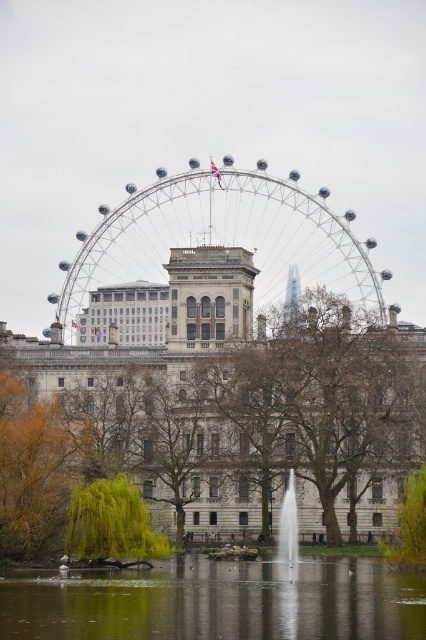
You are a GUI agent. You are given a task and a screenshot of the screen. Output one action in this format:
    pyautogui.click(x=<x>, y=<y>)
    Task: Click on the golden leafy tree at lower left
    
    Given the screenshot: What is the action you would take?
    pyautogui.click(x=34, y=468)

Between point (2, 500) and point (394, 552), which one is positioned in front?

Positioned in front is point (2, 500).

This screenshot has width=426, height=640. Identify the location of golden leafy tree at lower left. (34, 468).

Who is positioned more to the left, green reflective water at lower center or green leafy tree at lower left?

green leafy tree at lower left is more to the left.

Is green reflective water at lower center taller than green leafy tree at lower left?

In fact, green reflective water at lower center may be shorter than green leafy tree at lower left.

The image size is (426, 640). What are the coordinates of `green reflective water at lower center` in the screenshot? It's located at (218, 602).

Identify the location of green reflective water at lower center. [x=218, y=602].

Which of these two, white stone building at center or metallic ferris wheel at center, stands shorter?

Standing shorter between the two is metallic ferris wheel at center.

Can you confirm if white stone building at center is bigger than metallic ferris wheel at center?

Yes.

The width and height of the screenshot is (426, 640). I want to click on white stone building at center, so click(x=233, y=401).